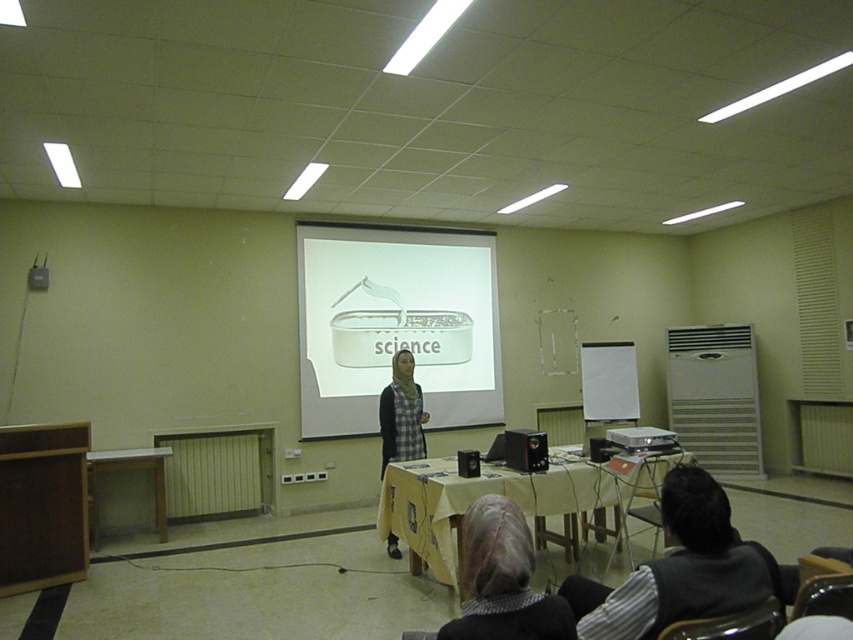
You are a student sitting in the classroom. You need to place a notebook on the wooden table at center. However, the notebook is currently on the white glossy projector screen at center. Can you directly place it onto the table without moving it to another surface first?

The white glossy projector screen at center is above the wooden table at center, so you can directly place the notebook from the screen onto the table without needing to move it to another surface first.

You are sitting in the classroom and want to see both the white glossy projector screen at center and the gray textured scarf at lower center clearly. Which one is closer to you?

The gray textured scarf at lower center is behind the white glossy projector screen at center, so the white glossy projector screen at center is closer to you.

You are standing in the classroom and need to locate the white glossy projector screen at center. According to the spatial coordinates provided, where exactly is it positioned?

The white glossy projector screen at center is located at point 0.506 on the x axis and 0.464 on the y axis.